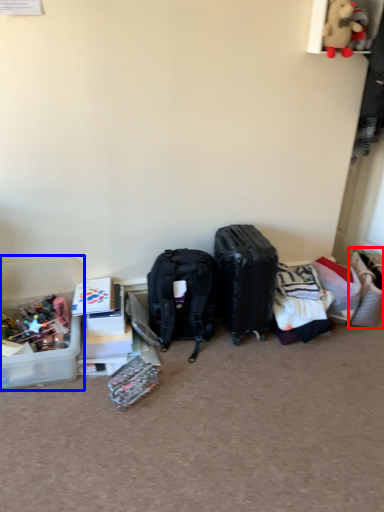
Question: Which point is closer to the camera, handbag (highlighted by a red box) or box (highlighted by a blue box)?

Choices:
 (A) handbag
 (B) box

Answer: (B)